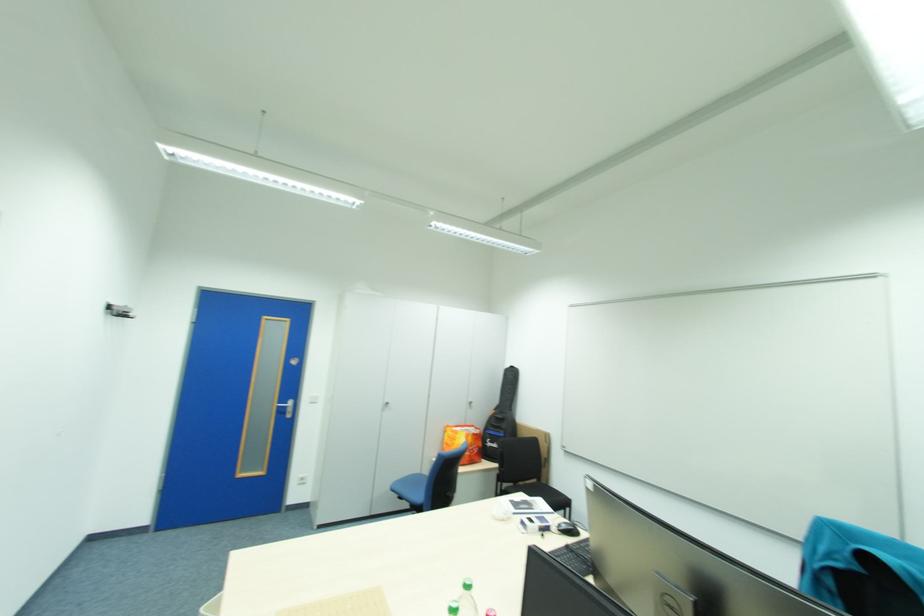
Where would you sit the blue chair sitting surface? Please return your answer as a coordinate pair (x, y).

(409, 488)